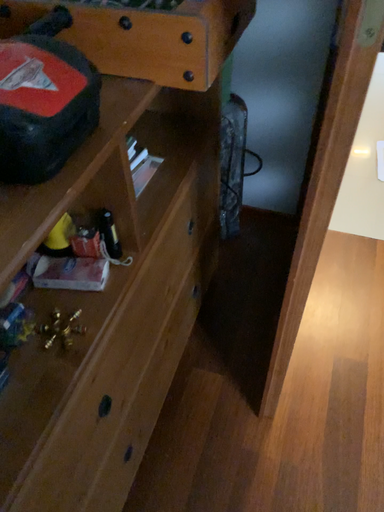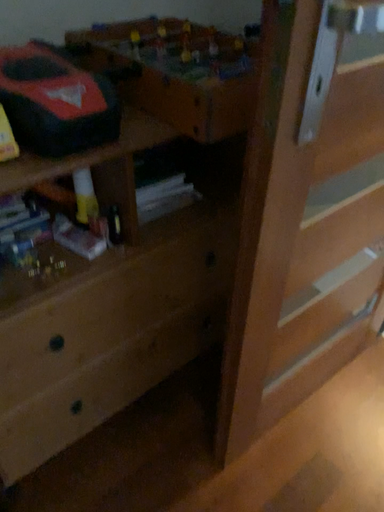
Question: How did the camera likely rotate when shooting the video?

Choices:
 (A) rotated left
 (B) rotated right

Answer: (A)